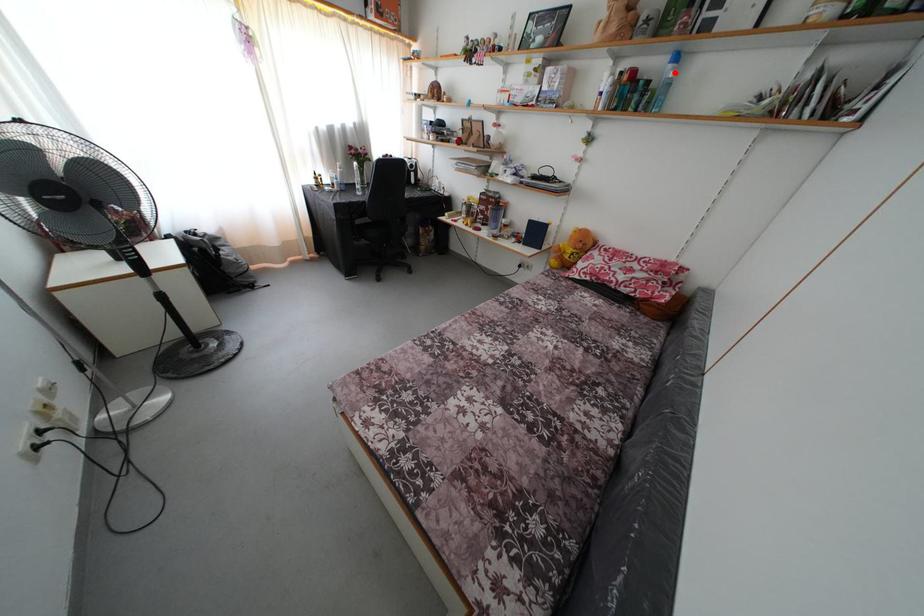
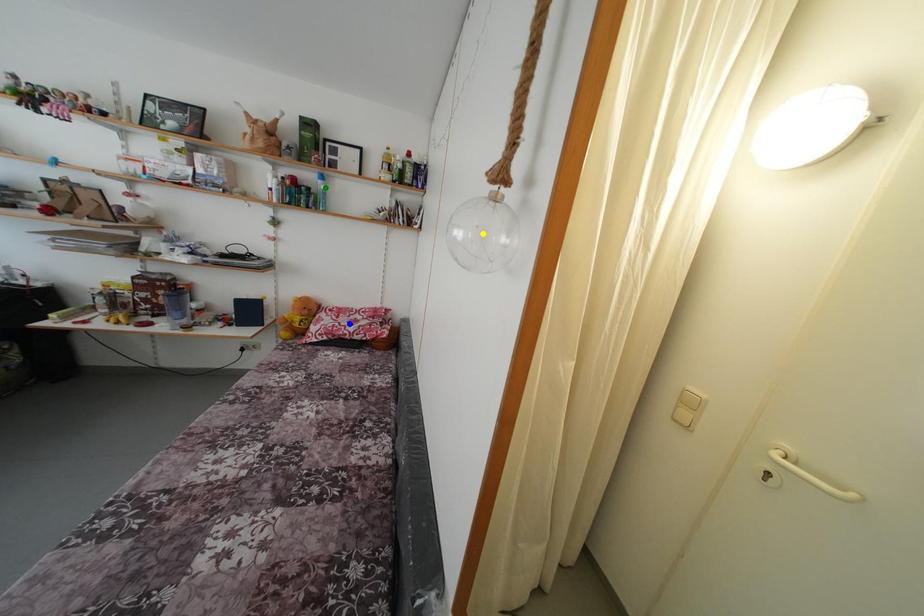
Question: I am providing you with two images of the same scene from different viewpoints. A red point is marked on the first image. You are given multiple points on the second image. Can you choose the point in image 2 that corresponds to the point in image 1?

Choices:
 (A) blue point
 (B) green point
 (C) yellow point

Answer: (B)